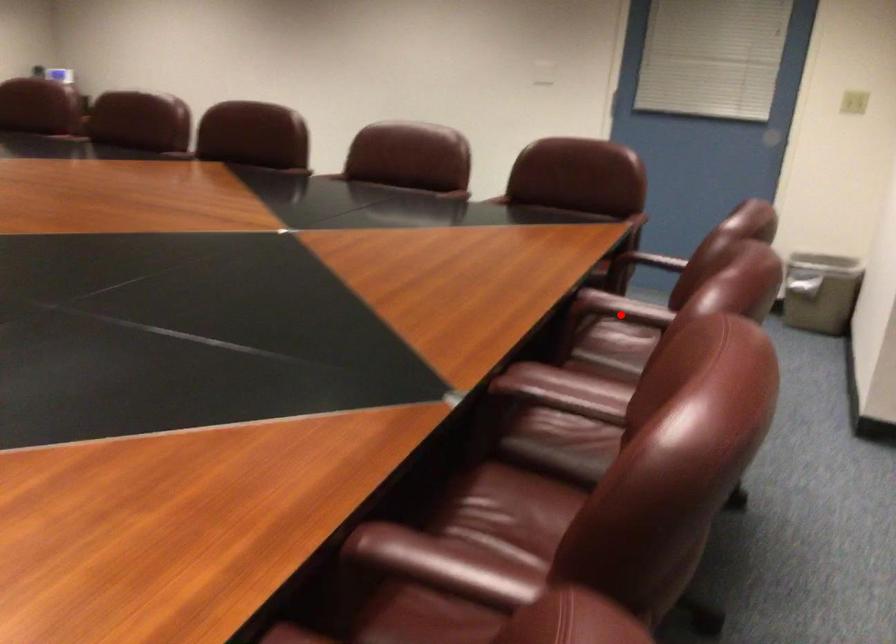
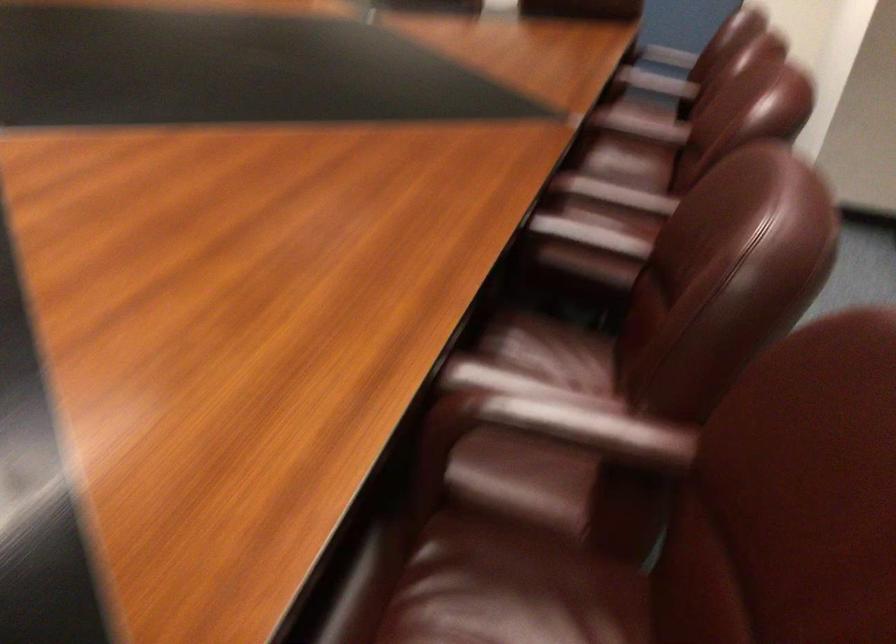
In the second image, find the point that corresponds to the highlighted location in the first image.

(656, 82)